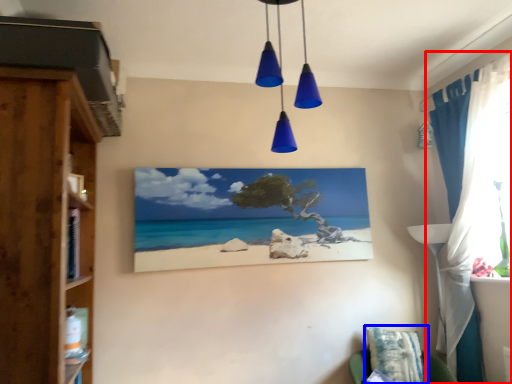
Question: Which of the following is the closest to the observer, curtain (highlighted by a red box) or pillow (highlighted by a blue box)?

Choices:
 (A) curtain
 (B) pillow

Answer: (A)